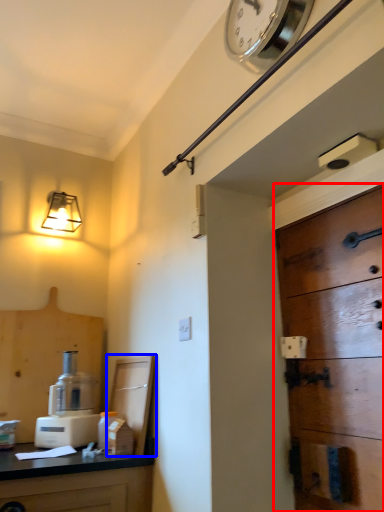
Question: Which of the following is the closest to the observer, door (highlighted by a red box) or cabinetry (highlighted by a blue box)?

Choices:
 (A) door
 (B) cabinetry

Answer: (A)